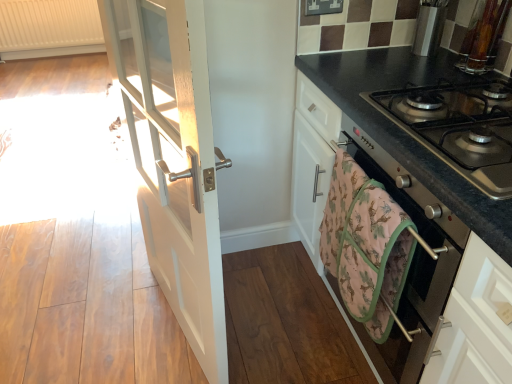
Question: In the image, is metallic oven at right on the left side or the right side of stainless steel gas stove at right?

Choices:
 (A) left
 (B) right

Answer: (A)

Question: Is point (334, 107) closer or farther from the camera than point (508, 99)?

Choices:
 (A) closer
 (B) farther

Answer: (B)

Question: Estimate the real-world distances between objects in this image. Which object is farther from the white textured radiator at upper left?

Choices:
 (A) metallic oven at right
 (B) pink fabric hand towel at lower right
 (C) white wood door at left
 (D) stainless steel gas stove at right

Answer: (B)

Question: Which of these objects is positioned closest to the white textured radiator at upper left?

Choices:
 (A) pink fabric hand towel at lower right
 (B) stainless steel gas stove at right
 (C) metallic oven at right
 (D) white wood door at left

Answer: (D)